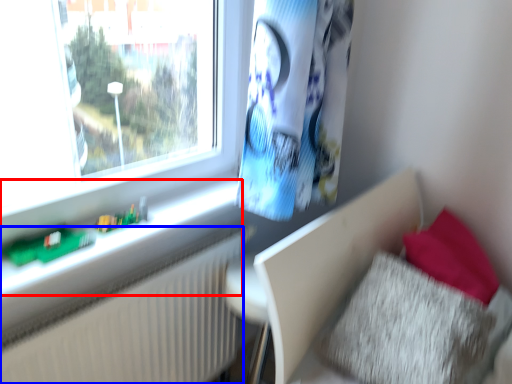
Question: Which of the following is the farthest to the observer, window sill (highlighted by a red box) or radiator (highlighted by a blue box)?

Choices:
 (A) window sill
 (B) radiator

Answer: (B)